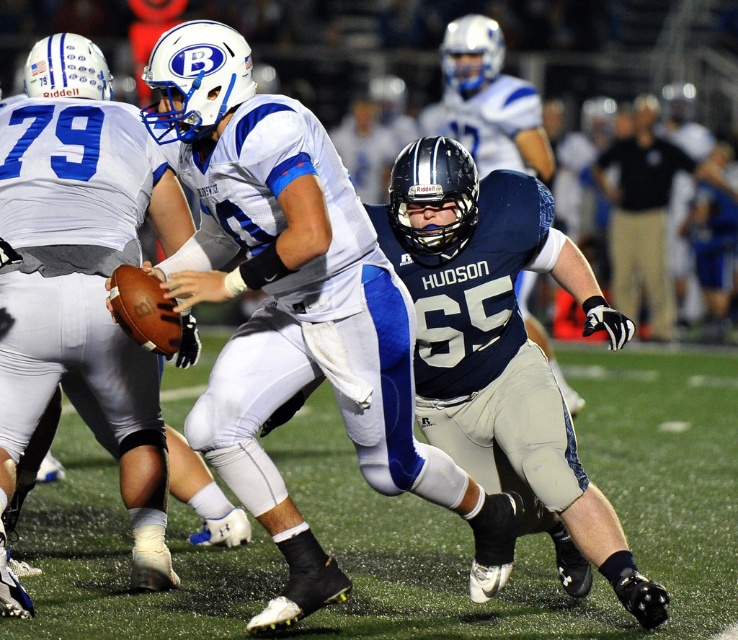
Is point (396, 524) farther from camera compared to point (663, 172)?

No.

Can you confirm if green turf at center is bigger than dark blue jersey at center?

No.

Who is more distant from viewer, (331, 525) or (692, 163)?

Point (692, 163)

This screenshot has width=738, height=640. Identify the location of green turf at center. (542, 532).

Does green turf at center have a greater height compared to matte blue jersey at center?

No, green turf at center is not taller than matte blue jersey at center.

Is point (421, 620) farther from viewer compared to point (480, 58)?

No.

You are a GUI agent. You are given a task and a screenshot of the screen. Output one action in this format:
    pyautogui.click(x=<x>, y=<y>)
    Task: Click on the green turf at center
    This screenshot has width=738, height=640.
    Given the screenshot: What is the action you would take?
    pyautogui.click(x=542, y=532)

Can you confirm if matte blue jersey at center is wider than dark blue jersey at center?

Incorrect, matte blue jersey at center's width does not surpass dark blue jersey at center's.

Who is lower down, matte blue jersey at center or dark blue jersey at center?

dark blue jersey at center

Where is `matte blue jersey at center`? The height and width of the screenshot is (640, 738). matte blue jersey at center is located at coordinates (486, 102).

At what (x,y) coordinates should I click in order to perform the action: click on matte blue jersey at center. Please return your answer as a coordinate pair (x, y). This screenshot has width=738, height=640. Looking at the image, I should click on (486, 102).